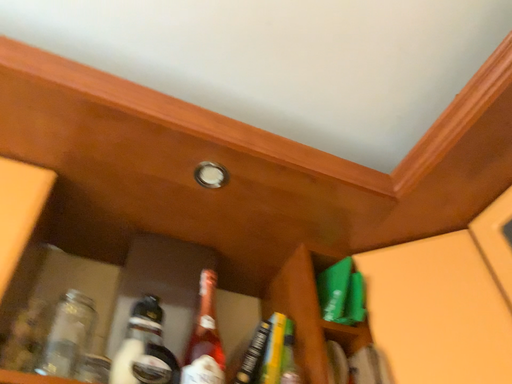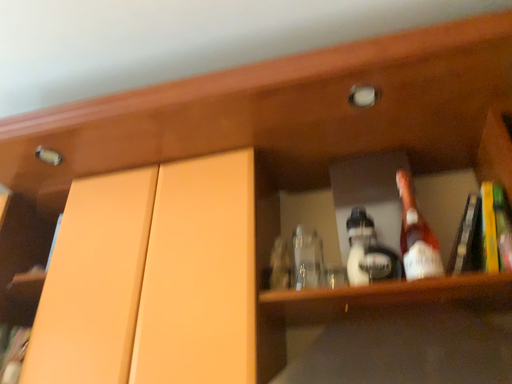
Question: How did the camera likely rotate when shooting the video?

Choices:
 (A) rotated left
 (B) rotated right

Answer: (A)